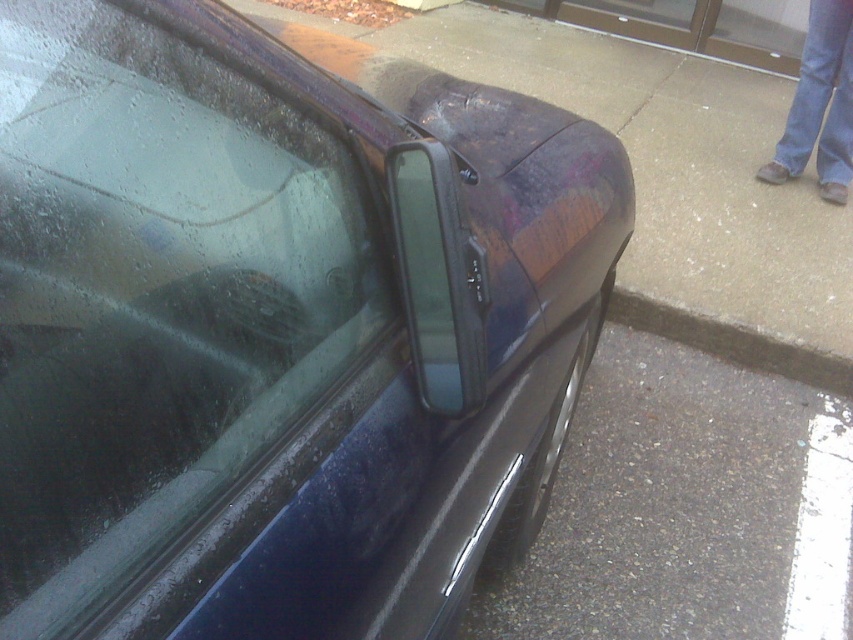
You are standing behind the dark car in the image. There is a point marked at coordinates (167, 301). Based on the car and its surroundings, where is this point located?

The point is on the transparent glass windshield at upper left.

You are standing next to the car and want to place a small trash bag on the ground. You have two options for placement based on the objects in the scene. Which location, the gray asphalt at lower right or the transparent plastic window at center, would allow the trash bag to be placed without overlapping the other object?

The gray asphalt at lower right has a larger size compared to the transparent plastic window at center, so placing the trash bag on the gray asphalt at lower right would provide more space and avoid overlapping the transparent plastic window at center.